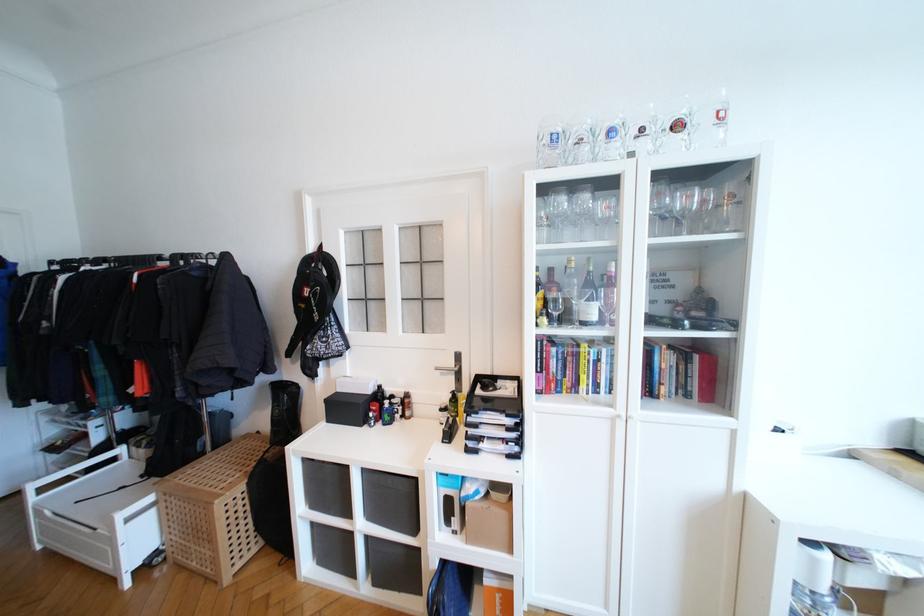
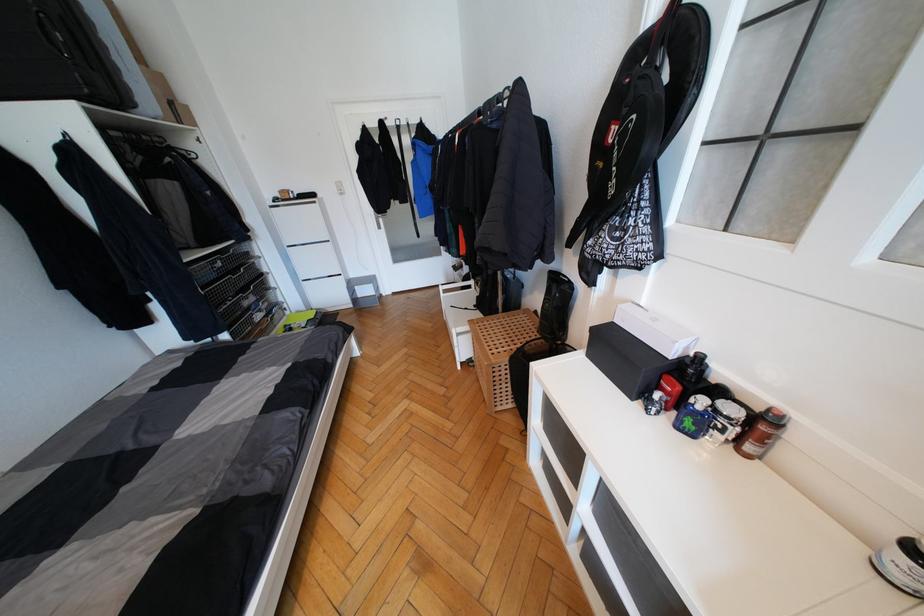
Where in the second image is the point corresponding to (409,402) from the first image?

(767, 429)